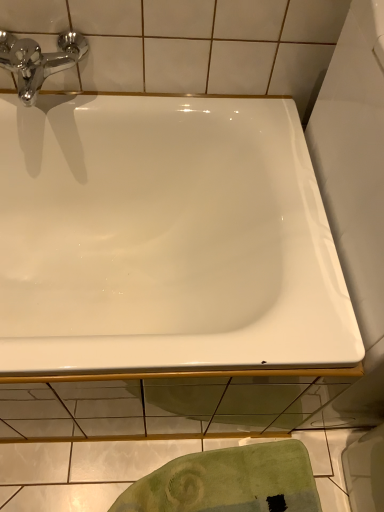
The image size is (384, 512). What are the coordinates of `white glossy bathtub at center` in the screenshot? It's located at (165, 239).

In order to face green textured towel at lower center, should I rotate leftwards or rightwards?

You should rotate left by 4.700 degrees.

This screenshot has height=512, width=384. What are the coordinates of `white glossy bathtub at center` in the screenshot? It's located at (165, 239).

In the scene shown: Considering their positions, is green textured towel at lower center located in front of or behind chrome/metallic faucet at upper left?

In the image, green textured towel at lower center appears behind chrome/metallic faucet at upper left.

From the image's perspective, is green textured towel at lower center located above chrome/metallic faucet at upper left?

Actually, green textured towel at lower center appears below chrome/metallic faucet at upper left in the image.

From a real-world perspective, is green textured towel at lower center over chrome/metallic faucet at upper left?

Actually, green textured towel at lower center is physically below chrome/metallic faucet at upper left in the real world.

From their relative heights in the image, would you say green textured towel at lower center is taller or shorter than chrome/metallic faucet at upper left?

In the image, green textured towel at lower center appears to be shorter than chrome/metallic faucet at upper left.

Is chrome/metallic faucet at upper left surrounded by white glossy bathtub at center?

No, chrome/metallic faucet at upper left is not inside white glossy bathtub at center.

Considering the points (18, 346) and (59, 39), which point is behind, point (18, 346) or point (59, 39)?

Point (59, 39)

What's the angular difference between white glossy bathtub at center and chrome/metallic faucet at upper left's facing directions?

The angle between the facing direction of white glossy bathtub at center and the facing direction of chrome/metallic faucet at upper left is 0.0429 degrees.

From the picture: Considering the relative sizes of white glossy bathtub at center and chrome/metallic faucet at upper left in the image provided, is white glossy bathtub at center taller than chrome/metallic faucet at upper left?

Yes.

Considering the relative sizes of chrome/metallic faucet at upper left and green textured towel at lower center in the image provided, is chrome/metallic faucet at upper left taller than green textured towel at lower center?

Yes.

Which object is positioned more to the left, chrome/metallic faucet at upper left or green textured towel at lower center?

Positioned to the left is chrome/metallic faucet at upper left.

Is chrome/metallic faucet at upper left facing away from green textured towel at lower center?

No, chrome/metallic faucet at upper left is not facing away from green textured towel at lower center.

Locate an element on the screen. tap on the left of green textured towel at lower center is located at coordinates (38, 60).

From the image's perspective, would you say chrome/metallic faucet at upper left is positioned over white glossy bathtub at center?

Yes, from the image's perspective, chrome/metallic faucet at upper left is over white glossy bathtub at center.

Image resolution: width=384 pixels, height=512 pixels. Find the location of `tap above the white glossy bathtub at center (from the image's perspective)`. tap above the white glossy bathtub at center (from the image's perspective) is located at coordinates (38, 60).

From a real-world perspective, is chrome/metallic faucet at upper left positioned under white glossy bathtub at center based on gravity?

No, from a real-world perspective, chrome/metallic faucet at upper left is not under white glossy bathtub at center.

Is chrome/metallic faucet at upper left in contact with white glossy bathtub at center?

No, chrome/metallic faucet at upper left is not touching white glossy bathtub at center.

Is white glossy bathtub at center positioned with its back to green textured towel at lower center?

No.

Is white glossy bathtub at center taller or shorter than green textured towel at lower center?

In the image, white glossy bathtub at center appears to be taller than green textured towel at lower center.

Considering the sizes of objects white glossy bathtub at center and green textured towel at lower center in the image provided, who is bigger, white glossy bathtub at center or green textured towel at lower center?

Bigger between the two is white glossy bathtub at center.

Could green textured towel at lower center be considered to be inside white glossy bathtub at center?

Actually, green textured towel at lower center is outside white glossy bathtub at center.

Can you confirm if green textured towel at lower center is positioned to the right of white glossy bathtub at center?

Correct, you'll find green textured towel at lower center to the right of white glossy bathtub at center.

From a real-world perspective, between green textured towel at lower center and white glossy bathtub at center, who is vertically higher?

In real-world perspective, white glossy bathtub at center is above.

From the image's perspective, is green textured towel at lower center positioned above or below white glossy bathtub at center?

Clearly, from the image's perspective, green textured towel at lower center is below white glossy bathtub at center.

Locate an element on the screen. This screenshot has width=384, height=512. bathtub located above the green textured towel at lower center (from a real-world perspective) is located at coordinates (165, 239).

This screenshot has width=384, height=512. In order to click on bath towel on the right of chrome/metallic faucet at upper left in this screenshot , I will do `click(229, 482)`.

Locate an element on the screen. This screenshot has height=512, width=384. tap behind the white glossy bathtub at center is located at coordinates (38, 60).

From the picture: Considering their positions, is white glossy bathtub at center positioned closer to chrome/metallic faucet at upper left than green textured towel at lower center?

white glossy bathtub at center is closer to chrome/metallic faucet at upper left.

Based on the photo, estimate the real-world distances between objects in this image. Which object is further from chrome/metallic faucet at upper left, green textured towel at lower center or white glossy bathtub at center?

Among the two, green textured towel at lower center is located further to chrome/metallic faucet at upper left.

Estimate the real-world distances between objects in this image. Which object is further from white glossy bathtub at center, chrome/metallic faucet at upper left or green textured towel at lower center?

green textured towel at lower center lies further to white glossy bathtub at center than the other object.

Which object lies further to the anchor point white glossy bathtub at center, green textured towel at lower center or chrome/metallic faucet at upper left?

green textured towel at lower center.

Considering their positions, is white glossy bathtub at center positioned closer to green textured towel at lower center than chrome/metallic faucet at upper left?

Based on the image, white glossy bathtub at center appears to be nearer to green textured towel at lower center.

Considering their positions, is chrome/metallic faucet at upper left positioned further to green textured towel at lower center than white glossy bathtub at center?

Among the two, chrome/metallic faucet at upper left is located further to green textured towel at lower center.

I want to click on bathtub between chrome/metallic faucet at upper left and green textured towel at lower center in the up-down direction, so click(x=165, y=239).